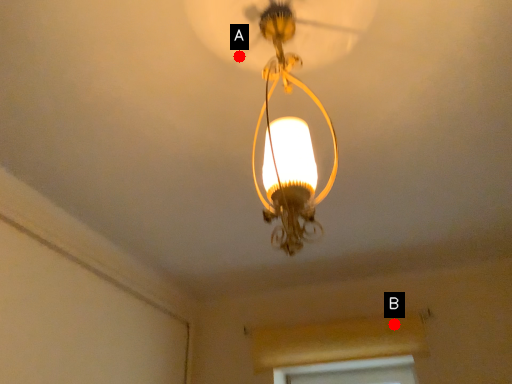
Question: Two points are circled on the image, labeled by A and B beside each circle. Which point is closer to the camera taking this photo?

Choices:
 (A) A is closer
 (B) B is closer

Answer: (A)